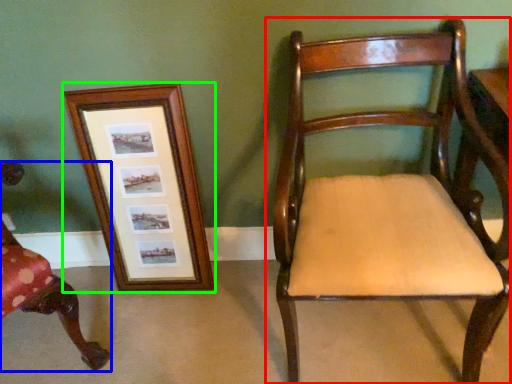
Question: Estimate the real-world distances between objects in this image. Which object is closer to chair (highlighted by a red box), chair (highlighted by a blue box) or picture frame (highlighted by a green box)?

Choices:
 (A) chair
 (B) picture frame

Answer: (B)